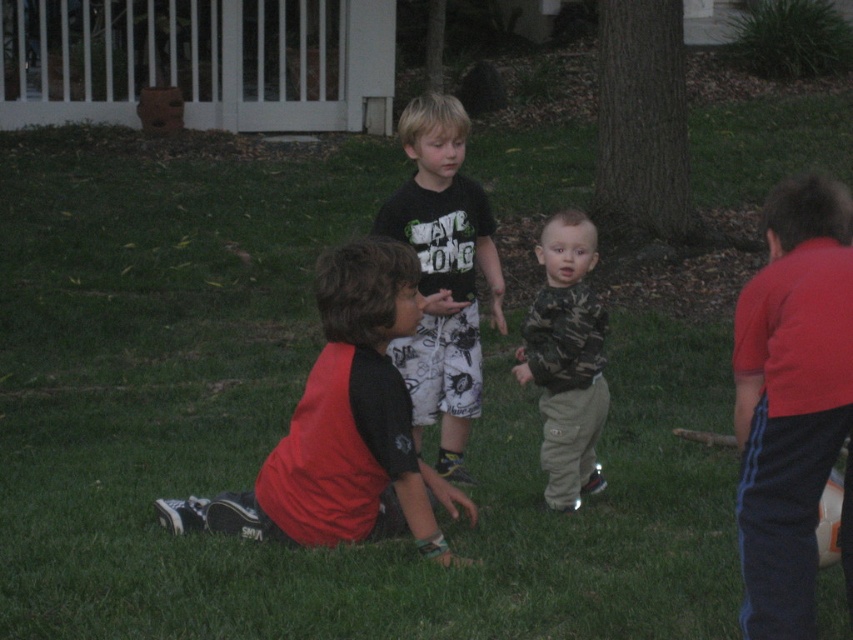
Can you confirm if black printed t-shirt at center is taller than camo fabric shirt at center?

Correct, black printed t-shirt at center is much taller as camo fabric shirt at center.

Between black printed t-shirt at center and camo fabric shirt at center, which one appears on the right side from the viewer's perspective?

camo fabric shirt at center

In the scene shown: Who is more distant from viewer, (463,372) or (561,352)?

The point (463,372) is more distant.

You are a GUI agent. You are given a task and a screenshot of the screen. Output one action in this format:
    pyautogui.click(x=<x>, y=<y>)
    Task: Click on the black printed t-shirt at center
    This screenshot has width=853, height=640.
    Given the screenshot: What is the action you would take?
    pyautogui.click(x=444, y=273)

What do you see at coordinates (346, 424) in the screenshot?
I see `red matte shirt at center` at bounding box center [346, 424].

Is point (329, 424) positioned before point (457, 216)?

Yes, point (329, 424) is closer to viewer.

Is point (403, 502) positioned after point (434, 193)?

No, it is in front of (434, 193).

Image resolution: width=853 pixels, height=640 pixels. In order to click on red matte shirt at center in this screenshot , I will do `click(346, 424)`.

Who is taller, red matte shirt at center or camo fabric shirt at center?

camo fabric shirt at center

Who is positioned more to the left, red matte shirt at center or camo fabric shirt at center?

red matte shirt at center is more to the left.

In order to click on red matte shirt at center in this screenshot , I will do tap(346, 424).